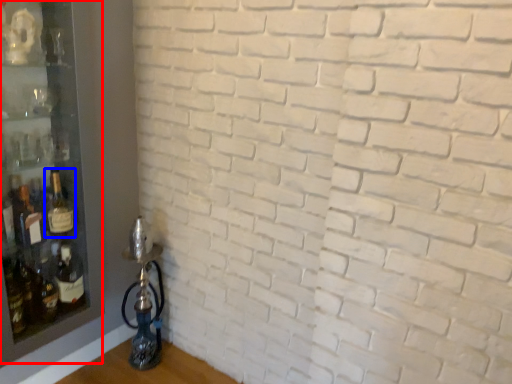
Question: Which of the following is the closest to the observer, shelf (highlighted by a red box) or bottle (highlighted by a blue box)?

Choices:
 (A) shelf
 (B) bottle

Answer: (A)